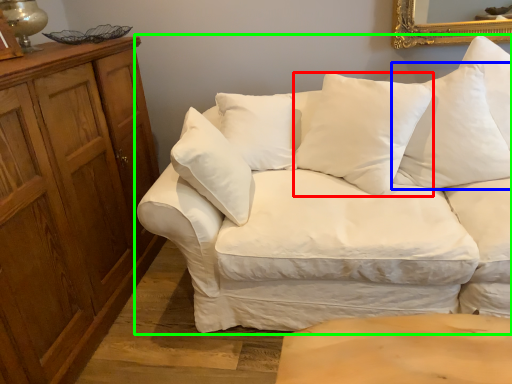
Question: Which object is positioned farthest from pillow (highlighted by a red box)? Select from pillow (highlighted by a blue box) and studio couch (highlighted by a green box).

Choices:
 (A) pillow
 (B) studio couch

Answer: (A)